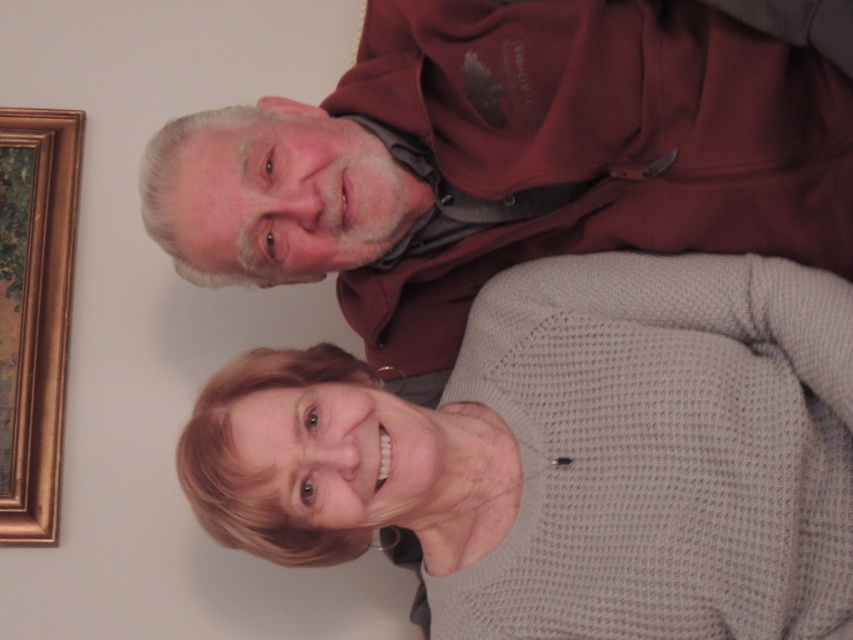
Question: Based on their relative distances, which object is nearer to the gold wooden picture frame at upper left?

Choices:
 (A) maroon hoodie at upper center
 (B) gray knitted sweater at center

Answer: (A)

Question: Which object is positioned closest to the gold wooden picture frame at upper left?

Choices:
 (A) maroon hoodie at upper center
 (B) gray knitted sweater at center

Answer: (A)

Question: Considering the real-world distances, which object is closest to the maroon hoodie at upper center?

Choices:
 (A) gold wooden picture frame at upper left
 (B) gray knitted sweater at center

Answer: (B)

Question: Considering the relative positions of maroon hoodie at upper center and gold wooden picture frame at upper left in the image provided, where is maroon hoodie at upper center located with respect to gold wooden picture frame at upper left?

Choices:
 (A) left
 (B) right

Answer: (B)

Question: Does gray knitted sweater at center have a larger size compared to maroon hoodie at upper center?

Choices:
 (A) yes
 (B) no

Answer: (B)

Question: Is the position of maroon hoodie at upper center more distant than that of gold wooden picture frame at upper left?

Choices:
 (A) no
 (B) yes

Answer: (A)